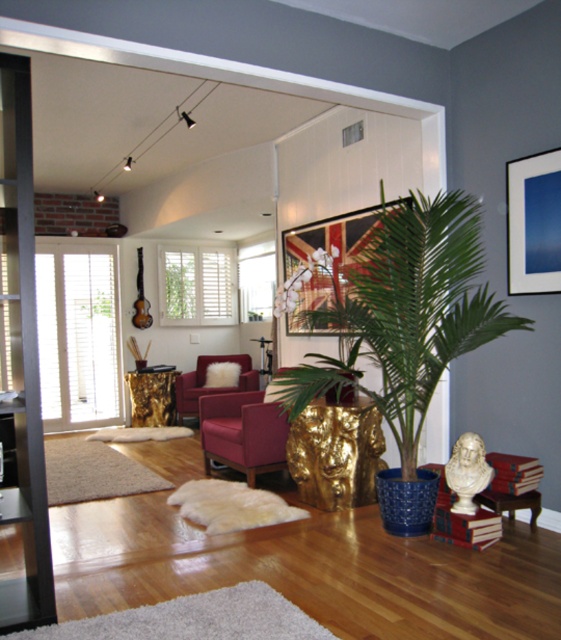
Can you confirm if metallic gold picture frame at upper center is smaller than blue matte picture frame at upper right?

Actually, metallic gold picture frame at upper center might be larger than blue matte picture frame at upper right.

Which is in front, point (357, 240) or point (508, 177)?

Point (508, 177)

Between point (319, 259) and point (551, 200), which one is positioned in front?

Point (551, 200) is in front.

Locate an element on the screen. The image size is (561, 640). metallic gold picture frame at upper center is located at coordinates (319, 268).

Can you confirm if green glossy plant at center is positioned below velvet burgundy armchair at center?

Incorrect, green glossy plant at center is not positioned below velvet burgundy armchair at center.

Which of these two, green glossy plant at center or velvet burgundy armchair at center, stands shorter?

Standing shorter between the two is velvet burgundy armchair at center.

Locate an element on the screen. Image resolution: width=561 pixels, height=640 pixels. green glossy plant at center is located at coordinates (406, 314).

Does green glossy plant at center appear on the left side of velvet maroon armchair at center?

Incorrect, green glossy plant at center is not on the left side of velvet maroon armchair at center.

Describe the element at coordinates (406, 314) in the screenshot. I see `green glossy plant at center` at that location.

Which is in front, point (388, 324) or point (201, 372)?

Point (388, 324)

The image size is (561, 640). Find the location of `green glossy plant at center`. green glossy plant at center is located at coordinates (406, 314).